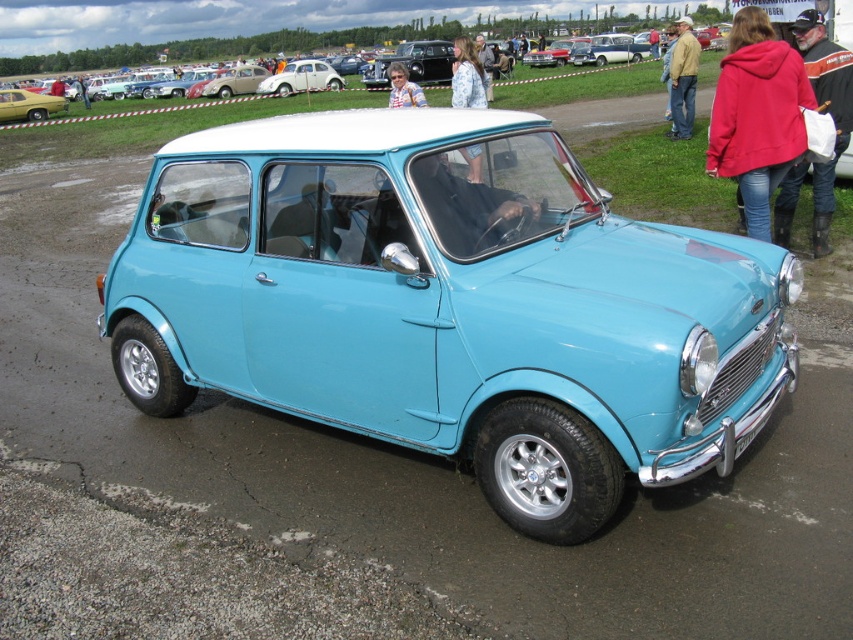
Is tan leather jacket at upper right smaller than light brown leather jacket at center?

No, tan leather jacket at upper right is not smaller than light brown leather jacket at center.

Is tan leather jacket at upper right thinner than light brown leather jacket at center?

No.

Who is more distant from viewer, (689, 40) or (416, 83)?

Positioned behind is point (416, 83).

This screenshot has height=640, width=853. In order to click on tan leather jacket at upper right in this screenshot , I will do `click(683, 80)`.

Between point (746, 138) and point (479, 145), which one is positioned behind?

The point (746, 138) is more distant.

Does red fleece jacket at upper right have a smaller size compared to blue fabric jacket at center?

Correct, red fleece jacket at upper right occupies less space than blue fabric jacket at center.

Is point (764, 113) behind point (469, 64)?

No, it is not.

The height and width of the screenshot is (640, 853). Find the location of `red fleece jacket at upper right`. red fleece jacket at upper right is located at coordinates (757, 115).

Is metallic silver car at center taller than yellow glossy car at upper left?

Yes, metallic silver car at center is taller than yellow glossy car at upper left.

Does point (621, 54) come closer to viewer compared to point (56, 104)?

No, it is behind (56, 104).

You are a GUI agent. You are given a task and a screenshot of the screen. Output one action in this format:
    pyautogui.click(x=<x>, y=<y>)
    Task: Click on the metallic silver car at center
    The image size is (853, 640).
    Given the screenshot: What is the action you would take?
    pyautogui.click(x=608, y=51)